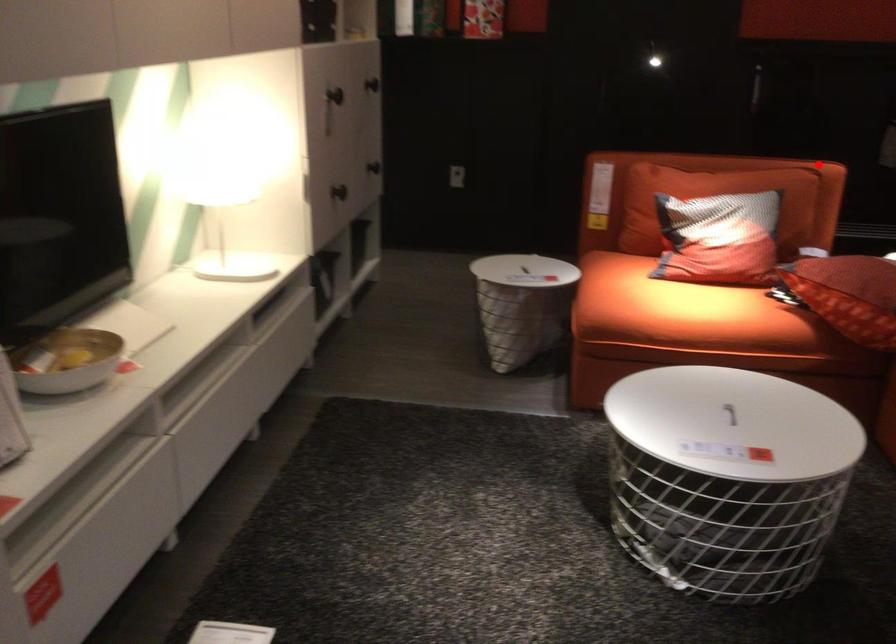
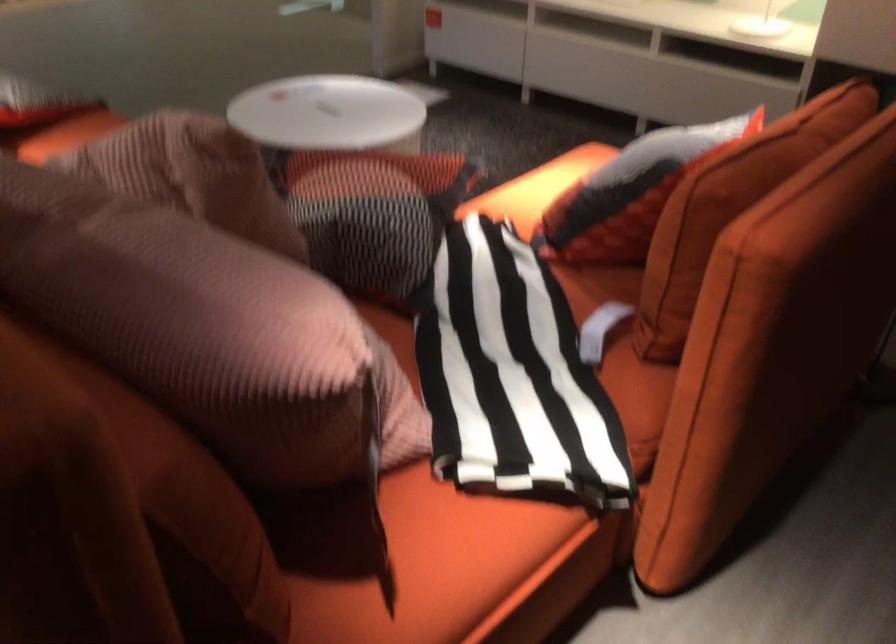
In the second image, find the point that corresponds to the highlighted location in the first image.

(730, 207)